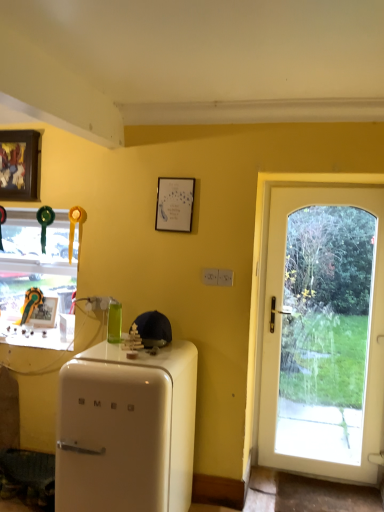
Question: Which direction should I rotate to look at white matte picture frame at upper center, acting as the third picture frame starting from the left?

Choices:
 (A) left
 (B) right

Answer: (A)

Question: Can you confirm if wooden framed artwork at upper left, marked as the 2th picture frame in a front-to-back arrangement, is bigger than matte black picture frame at left, placed as the third picture frame when sorted from top to bottom?

Choices:
 (A) no
 (B) yes

Answer: (B)

Question: Is wooden framed artwork at upper left, the 2th picture frame when ordered from right to left, oriented away from matte black picture frame at left, which is counted as the 1th picture frame, starting from the bottom?

Choices:
 (A) yes
 (B) no

Answer: (B)

Question: Is wooden framed artwork at upper left, acting as the 3th picture frame starting from the bottom, behind matte black picture frame at left, which is the third picture frame in front-to-back order?

Choices:
 (A) yes
 (B) no

Answer: (B)

Question: Can you confirm if wooden framed artwork at upper left, acting as the 3th picture frame starting from the bottom, is positioned to the left of matte black picture frame at left, which is the third picture frame in front-to-back order?

Choices:
 (A) yes
 (B) no

Answer: (B)

Question: Is wooden framed artwork at upper left, acting as the 3th picture frame starting from the bottom, shorter than matte black picture frame at left, which is counted as the 1th picture frame, starting from the bottom?

Choices:
 (A) no
 (B) yes

Answer: (A)

Question: Is wooden framed artwork at upper left, positioned as the second picture frame in left-to-right order, aimed at matte black picture frame at left, the third picture frame from the right?

Choices:
 (A) no
 (B) yes

Answer: (A)

Question: Can you confirm if green glass bottle at center is wider than white glossy refrigerator at lower left?

Choices:
 (A) no
 (B) yes

Answer: (A)

Question: Is green glass bottle at center to the right of white glossy refrigerator at lower left from the viewer's perspective?

Choices:
 (A) no
 (B) yes

Answer: (A)

Question: Considering the relative sizes of green glass bottle at center and white glossy refrigerator at lower left in the image provided, is green glass bottle at center thinner than white glossy refrigerator at lower left?

Choices:
 (A) no
 (B) yes

Answer: (B)

Question: Would you say white glossy refrigerator at lower left is part of green glass bottle at center's contents?

Choices:
 (A) yes
 (B) no

Answer: (B)

Question: From the image's perspective, is green glass bottle at center located above white glossy refrigerator at lower left?

Choices:
 (A) no
 (B) yes

Answer: (B)

Question: Is green glass bottle at center positioned before white glossy refrigerator at lower left?

Choices:
 (A) yes
 (B) no

Answer: (B)

Question: Is white matte picture frame at upper center, acting as the third picture frame starting from the left, located within green glass bottle at center?

Choices:
 (A) yes
 (B) no

Answer: (B)